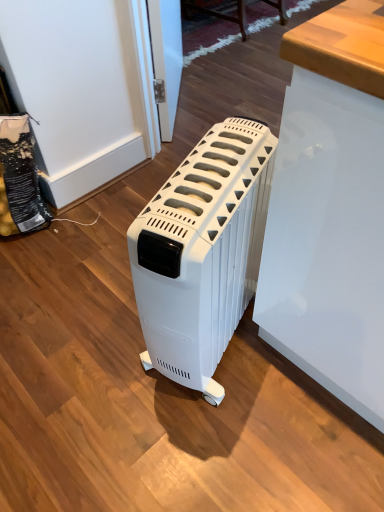
Find the location of a particular element. The height and width of the screenshot is (512, 384). free space on the front side of white plastic radiator at center is located at coordinates (213, 443).